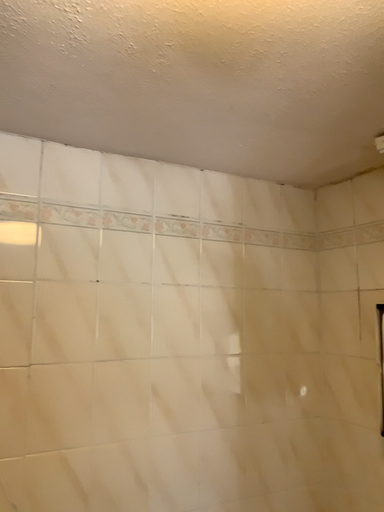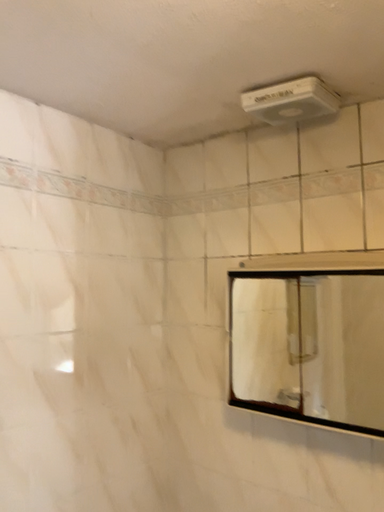
Question: Which way did the camera rotate in the video?

Choices:
 (A) rotated right
 (B) rotated left

Answer: (A)